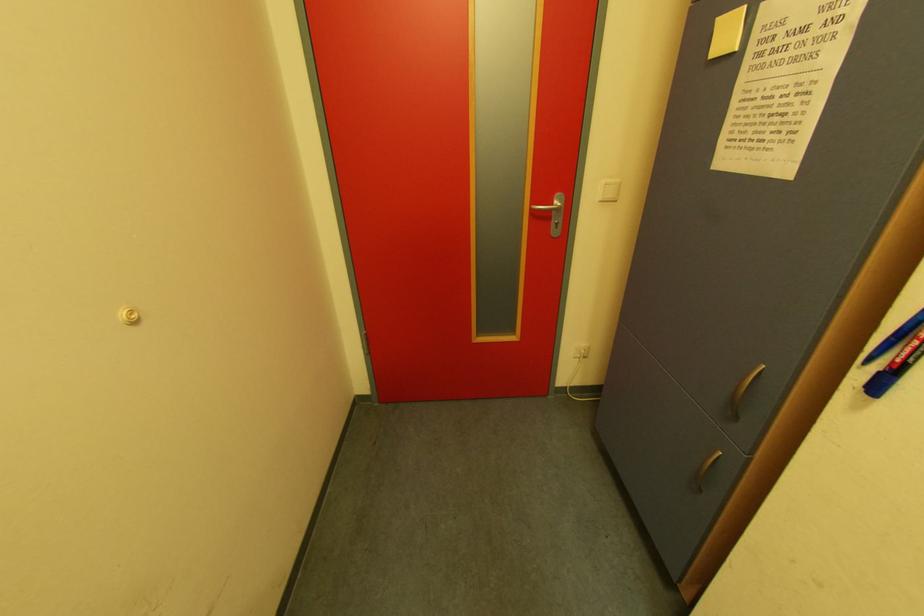
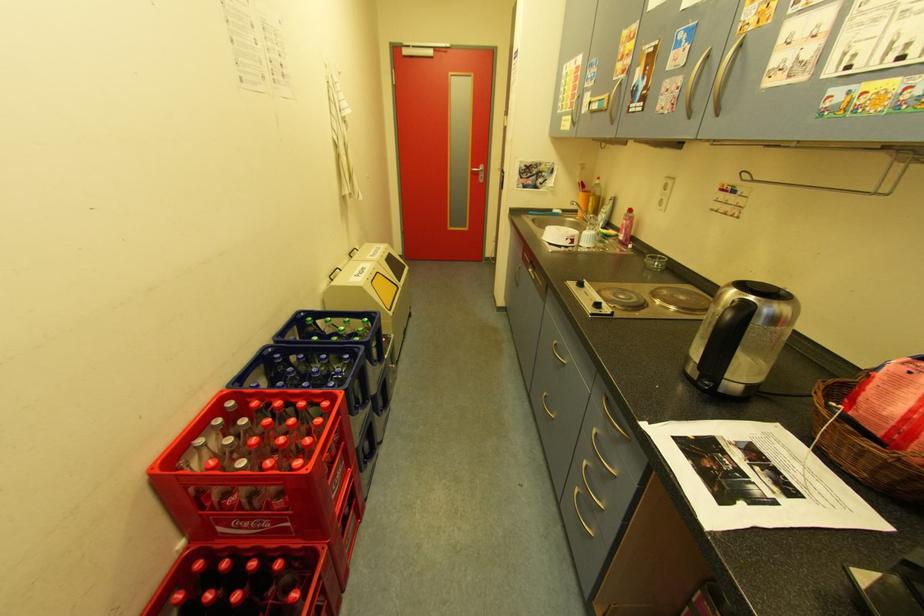
Question: In a continuous first-person perspective shot, in which direction is the camera moving?

Choices:
 (A) Left
 (B) Right
 (C) Forward
 (D) Backward

Answer: (D)